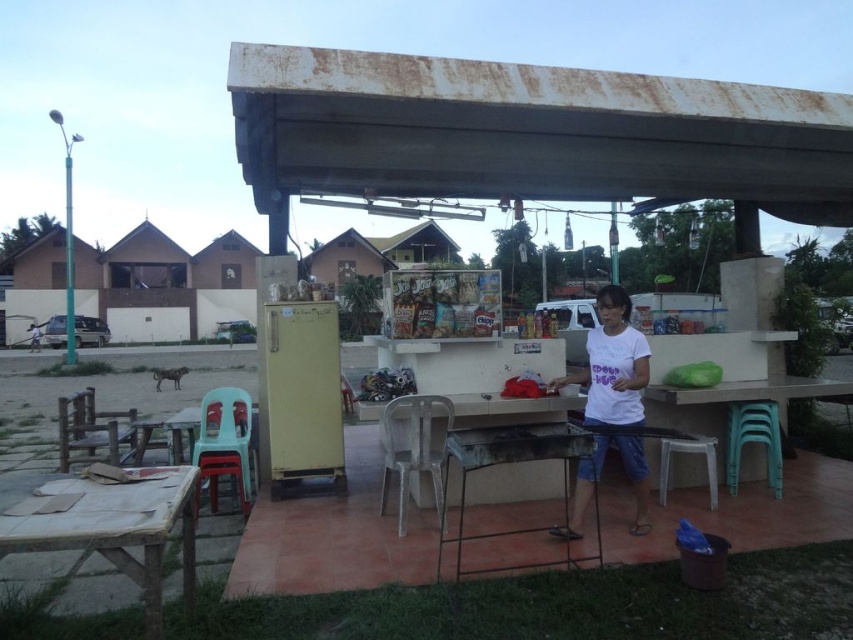
You are a customer at the food stall and want to sit down while waiting for your order. There is a metallic gray grill at center and a white plastic stool at lower right. Which object should you approach to sit?

You should approach the white plastic stool at lower right because the metallic gray grill at center is closer to the viewer, meaning the stool is farther away and likely accessible for sitting.

You are a customer at the food stall and want to sit down while waiting for your order. There is a white plastic stool at lower right and a metallic gray grill at center. Which object should you approach to find a place to sit?

You should approach the white plastic stool at lower right because it is a seating option, while the metallic gray grill at center is likely used for cooking and not for sitting.

You are a customer at the food stall and want to sit down. You see a wooden table at lower left and a green plastic table at center. Which table is shorter?

The wooden table at lower left is shorter than the green plastic table at center.